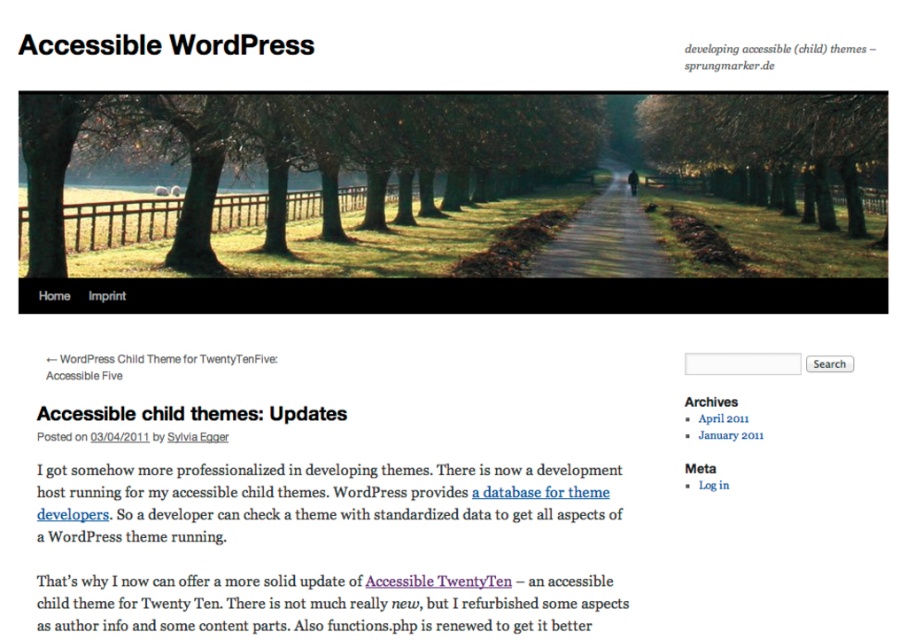
Can you confirm if green matte tree at center is positioned to the left of brown dirt path at center?

Yes, green matte tree at center is to the left of brown dirt path at center.

Which is in front, point (100, 228) or point (611, 262)?

Point (611, 262) is more forward.

What are the coordinates of `green matte tree at center` in the screenshot? It's located at (342, 168).

Who is higher up, brown textured tree at center or brown dirt path at center?

brown textured tree at center is above.

Does brown textured tree at center have a lesser width compared to brown dirt path at center?

Incorrect, brown textured tree at center's width is not less than brown dirt path at center's.

Between point (861, 97) and point (571, 259), which one is positioned behind?

The point (571, 259) is more distant.

You are a GUI agent. You are given a task and a screenshot of the screen. Output one action in this format:
    pyautogui.click(x=<x>, y=<y>)
    Task: Click on the brown textured tree at center
    Image resolution: width=907 pixels, height=640 pixels.
    Given the screenshot: What is the action you would take?
    coord(769,140)

Who is positioned more to the left, green matte tree at center or brown textured tree at center?

From the viewer's perspective, green matte tree at center appears more on the left side.

Is green matte tree at center below brown textured tree at center?

Yes.

Is point (144, 228) farther from camera compared to point (699, 138)?

No, it is in front of (699, 138).

Where is `green matte tree at center`? green matte tree at center is located at coordinates (342, 168).